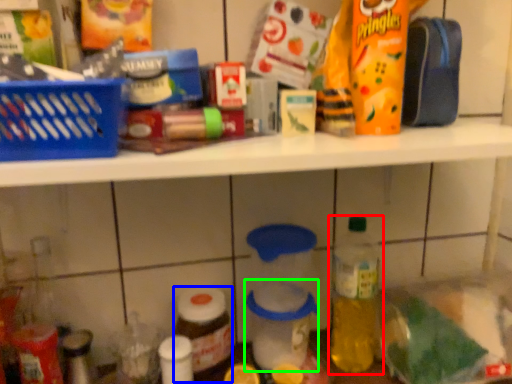
Question: Estimate the real-world distances between objects in this image. Which object is farther from bottle (highlighted by a red box), bottle (highlighted by a blue box) or glass jar (highlighted by a green box)?

Choices:
 (A) bottle
 (B) glass jar

Answer: (A)